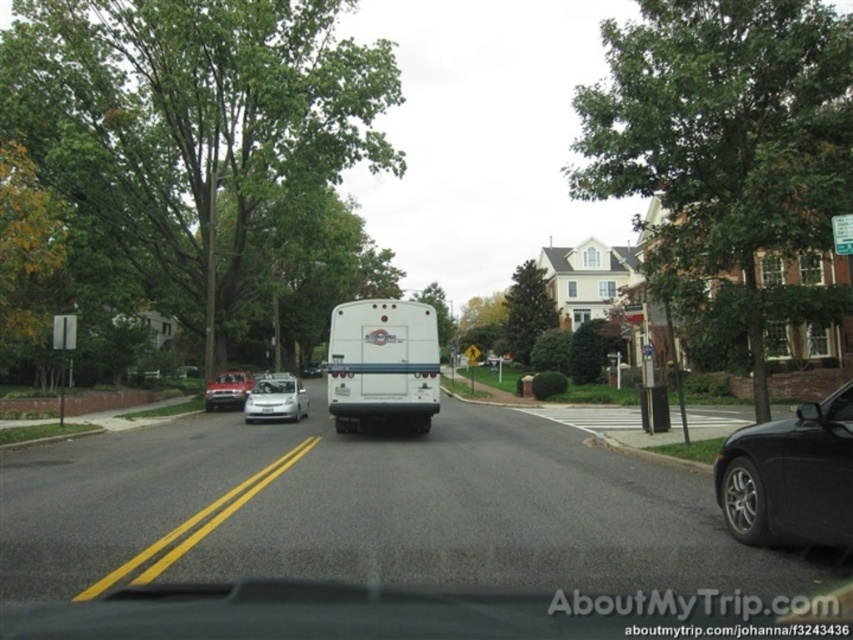
Question: Can you confirm if sleek silver sedan at center is positioned to the left of shiny silver sedan at center-left?

Choices:
 (A) yes
 (B) no

Answer: (B)

Question: Which object is positioned closest to the shiny silver sedan at center-left?

Choices:
 (A) black metallic car at right
 (B) green leafy tree at upper left
 (C) green leafy tree at upper right
 (D) green leafy tree at center

Answer: (B)

Question: Does green leafy tree at upper left have a larger size compared to green leafy tree at upper right?

Choices:
 (A) no
 (B) yes

Answer: (A)

Question: Which object is positioned farthest from the white matte ambulance at center?

Choices:
 (A) sleek silver sedan at center
 (B) green leafy tree at upper right
 (C) green leafy tree at center

Answer: (C)

Question: Does green leafy tree at upper left appear under sleek silver sedan at center?

Choices:
 (A) no
 (B) yes

Answer: (A)

Question: Which of the following is the farthest from the observer?

Choices:
 (A) (286, 380)
 (B) (403, 406)

Answer: (A)